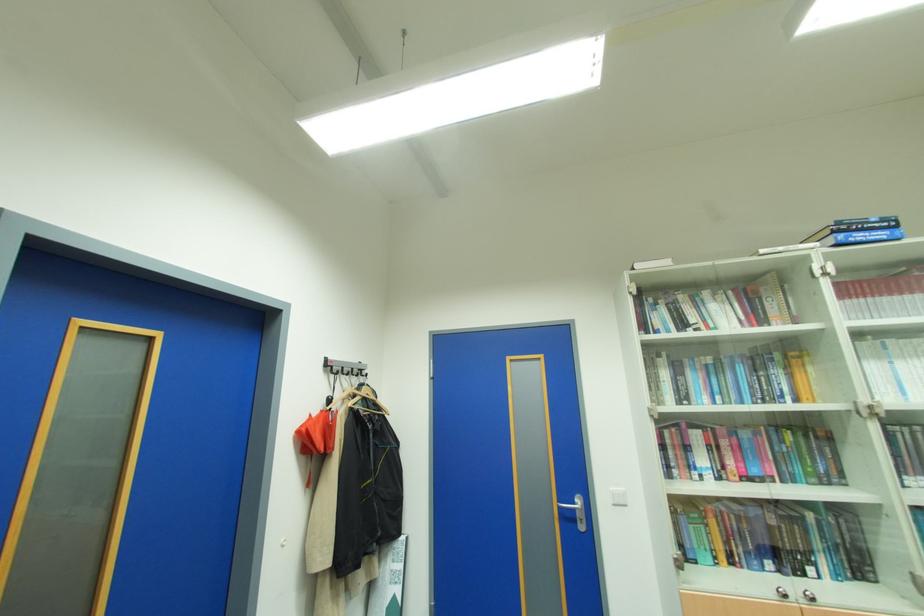
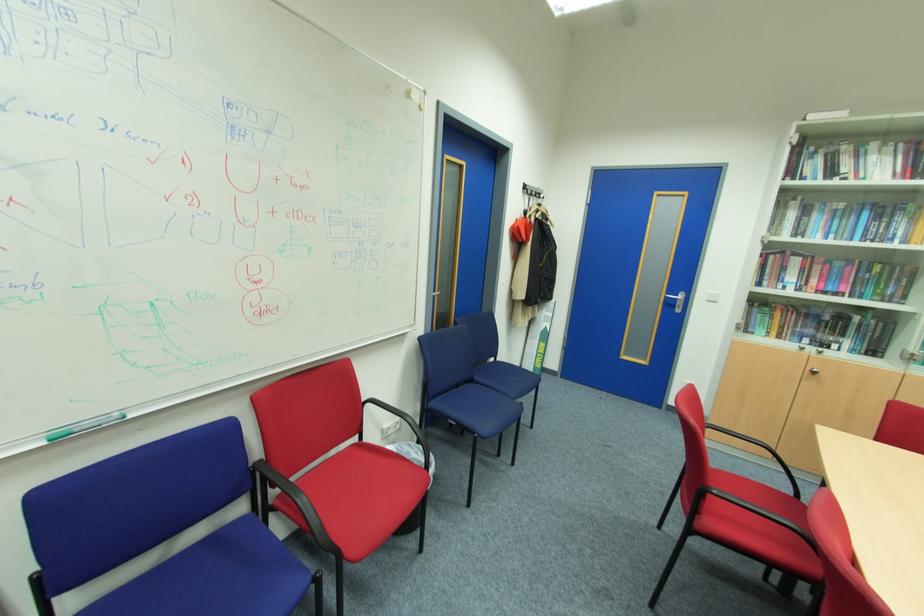
In the second image, find the point that corresponds to point 745,402 in the first image.

(854, 240)